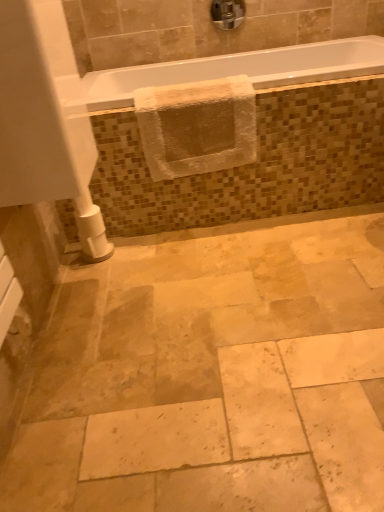
Question: From a real-world perspective, is natural stone tile at center over white glossy bathtub at upper center?

Choices:
 (A) yes
 (B) no

Answer: (B)

Question: Does natural stone tile at center have a larger size compared to white glossy bathtub at upper center?

Choices:
 (A) yes
 (B) no

Answer: (A)

Question: Could you tell me if natural stone tile at center is turned towards white glossy bathtub at upper center?

Choices:
 (A) no
 (B) yes

Answer: (A)

Question: Does natural stone tile at center have a lesser height compared to white glossy bathtub at upper center?

Choices:
 (A) yes
 (B) no

Answer: (B)

Question: Is natural stone tile at center surrounding white glossy bathtub at upper center?

Choices:
 (A) yes
 (B) no

Answer: (B)

Question: From the image's perspective, is natural stone tile at center above white glossy bathtub at upper center?

Choices:
 (A) yes
 (B) no

Answer: (B)

Question: Is white textured towel at upper center located outside white glossy bathtub at upper center?

Choices:
 (A) no
 (B) yes

Answer: (B)

Question: Considering the relative positions of white textured towel at upper center and white glossy bathtub at upper center in the image provided, is white textured towel at upper center behind white glossy bathtub at upper center?

Choices:
 (A) yes
 (B) no

Answer: (B)

Question: Could white glossy bathtub at upper center be considered to be inside white textured towel at upper center?

Choices:
 (A) yes
 (B) no

Answer: (B)

Question: From the image's perspective, is white textured towel at upper center on white glossy bathtub at upper center?

Choices:
 (A) yes
 (B) no

Answer: (B)

Question: From a real-world perspective, is white textured towel at upper center over white glossy bathtub at upper center?

Choices:
 (A) yes
 (B) no

Answer: (B)

Question: From the image's perspective, is white textured towel at upper center below white glossy bathtub at upper center?

Choices:
 (A) no
 (B) yes

Answer: (B)

Question: Considering the relative sizes of chrome metallic faucet at upper center and white glossy bathtub at upper center in the image provided, is chrome metallic faucet at upper center thinner than white glossy bathtub at upper center?

Choices:
 (A) yes
 (B) no

Answer: (A)